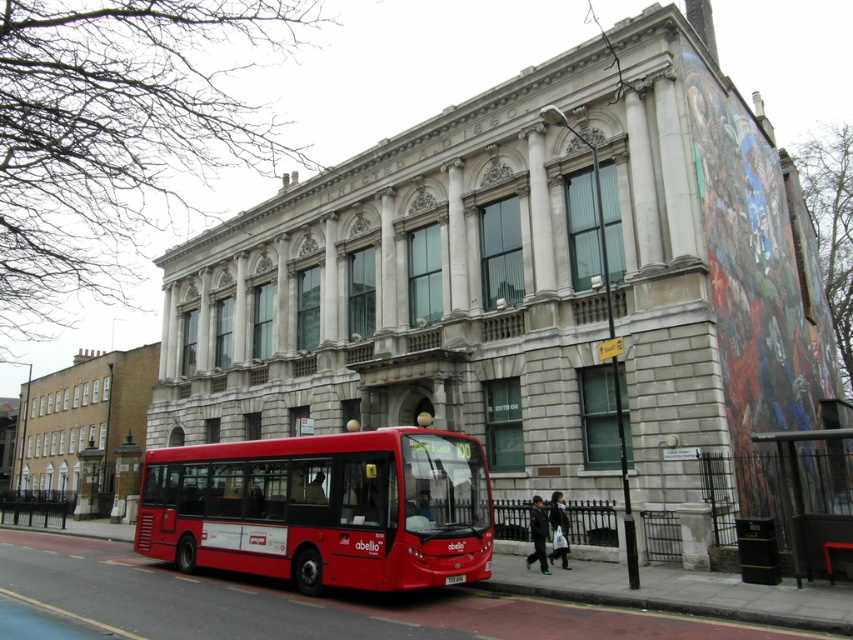
You are standing at the point marked as point (144, 500). You want to walk directly towards the viewer. How far will you have to walk to reach the viewer?

You are currently 44.30 meters away from the viewer, so you will have to walk 44.30 meters to reach them.

You are a city planner analyzing traffic flow. You need to determine if the shiny red bus at center can be parked perpendicular to the metallic black bus stop at lower right without overlapping. Can it fit based on their sizes?

The shiny red bus at center is wider than the metallic black bus stop at lower right. Since the bus is wider, parking it perpendicular might require more space, but the exact feasibility depends on the available space not specified here. However, based solely on width comparison, the bus is wider so it may not fit without overlapping.